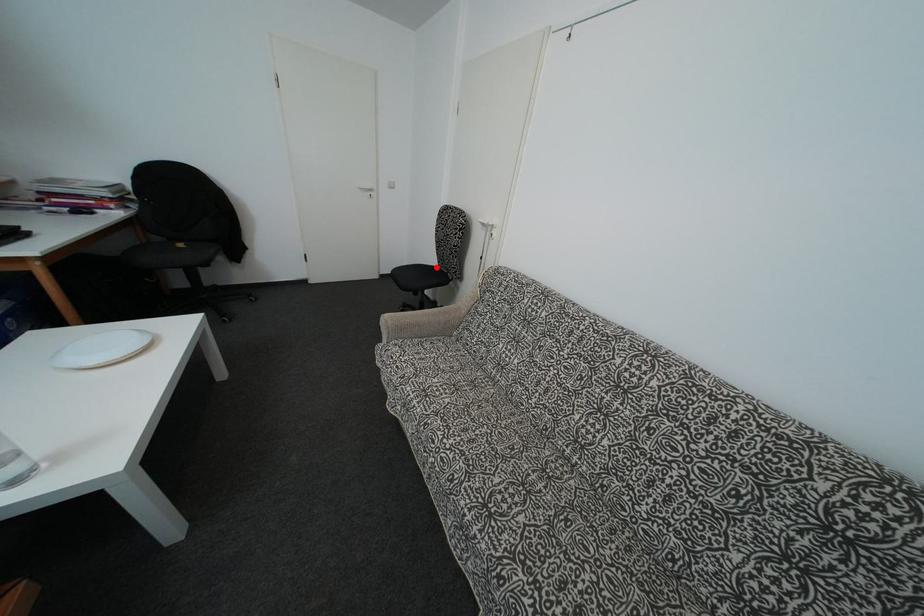
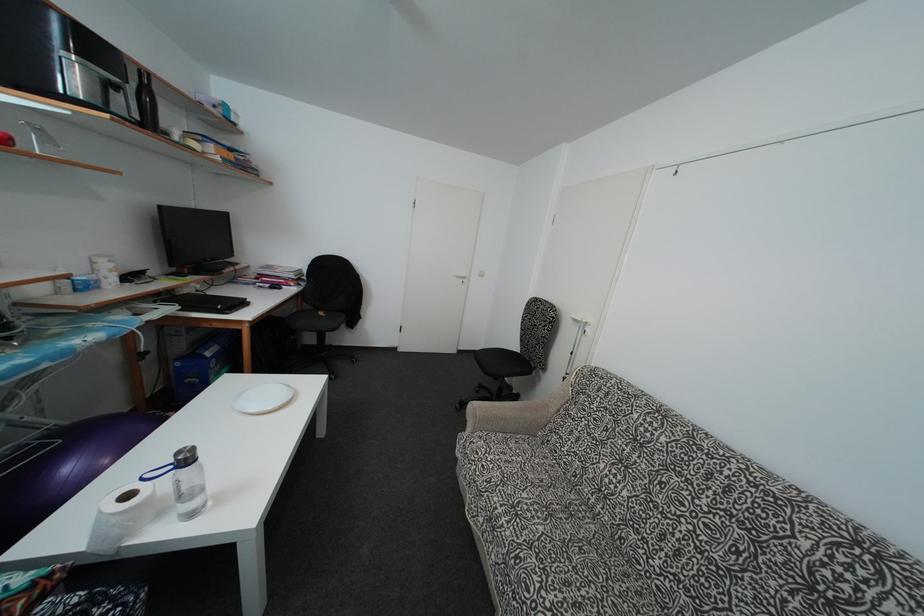
Question: I am providing you with two images of the same scene from different viewpoints. Given a red point in image1, look at the same physical point in image2. Is it:

Choices:
 (A) Closer to the viewpoint
 (B) Farther from the viewpoint

Answer: (B)